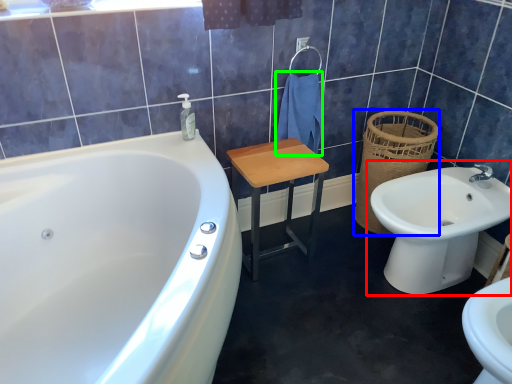
Question: Which object is positioned farthest from sink (highlighted by a red box)? Select from basket (highlighted by a blue box) and bath towel (highlighted by a green box).

Choices:
 (A) basket
 (B) bath towel

Answer: (B)